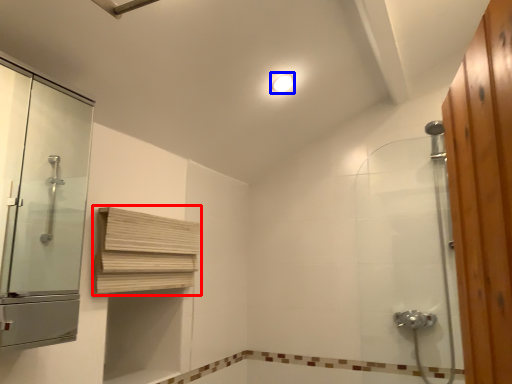
Question: Which object appears closest to the camera in this image, shelf (highlighted by a red box) or light fixture (highlighted by a blue box)?

Choices:
 (A) shelf
 (B) light fixture

Answer: (A)